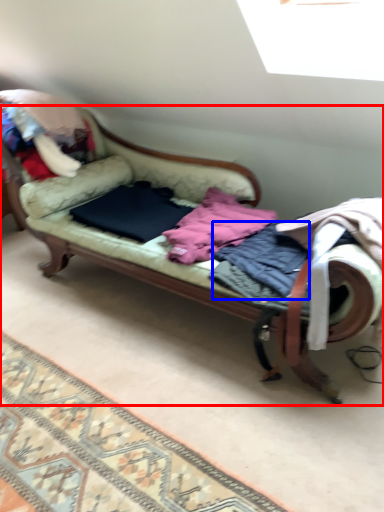
Question: Which point is closer to the camera, studio couch (highlighted by a red box) or clothing (highlighted by a blue box)?

Choices:
 (A) studio couch
 (B) clothing

Answer: (A)